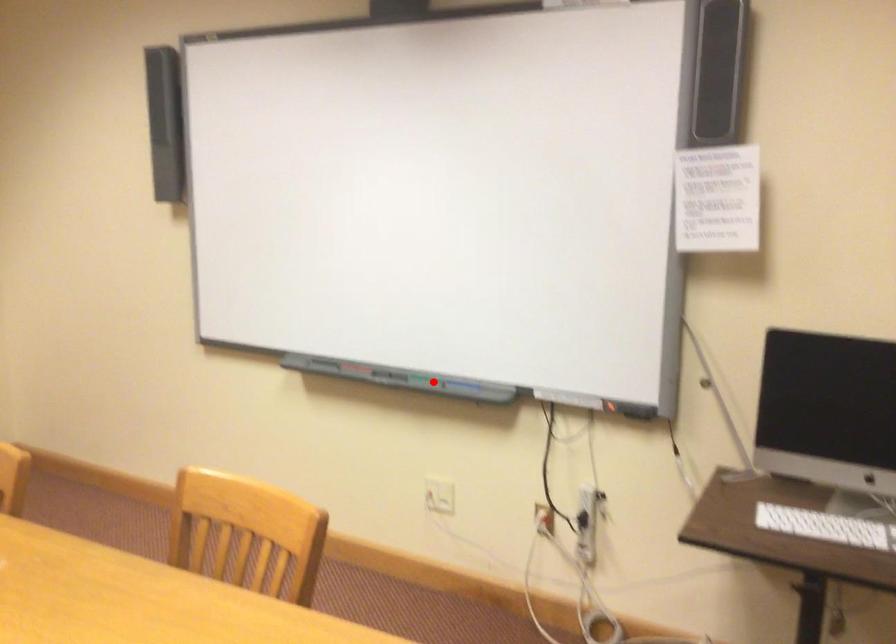
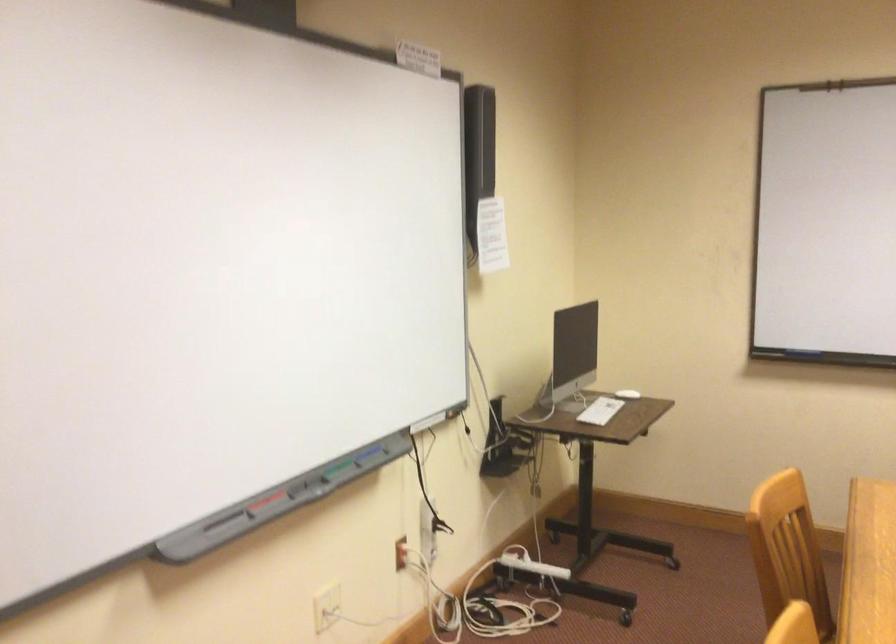
The point at the highlighted location is marked in the first image. Where is the corresponding point in the second image?

(333, 468)